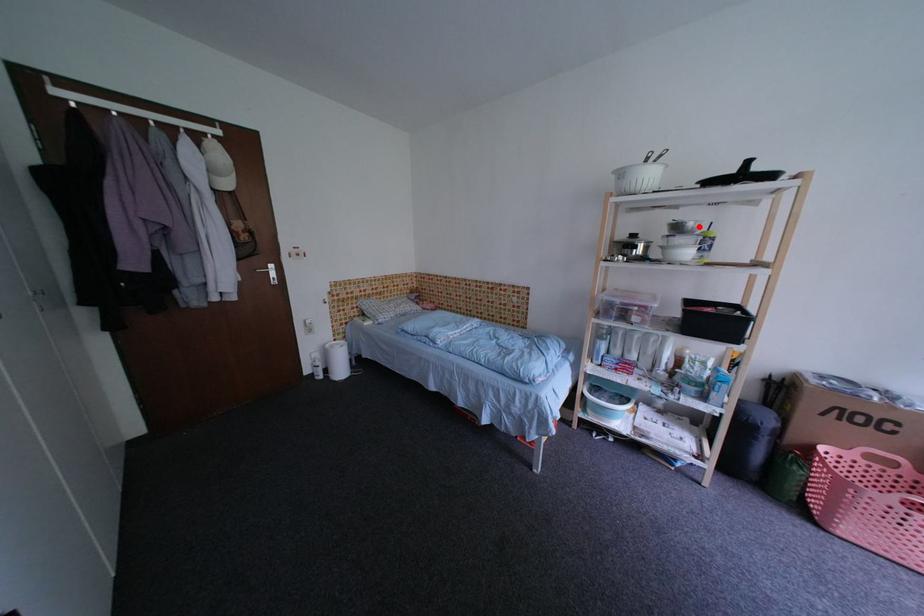
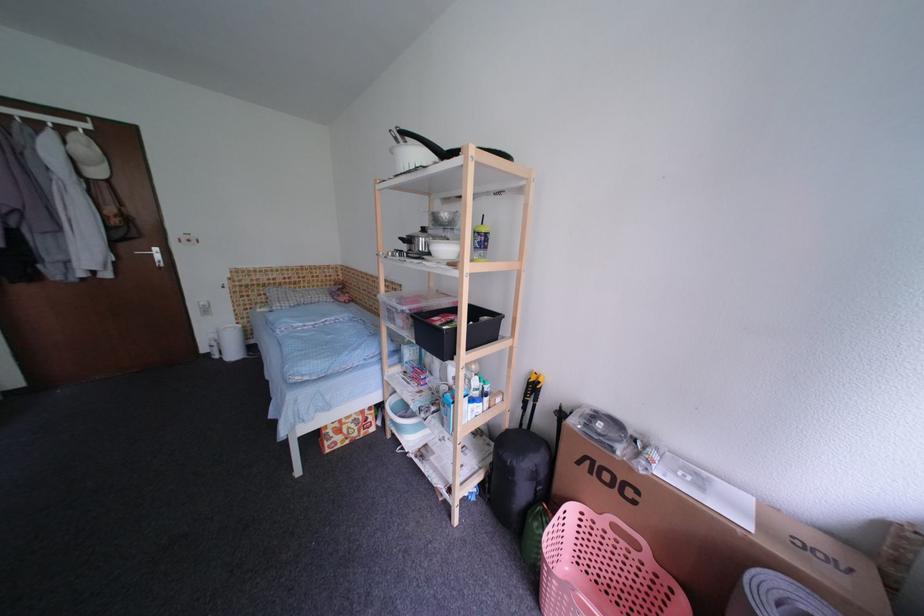
Locate, in the second image, the point that corresponds to the highlighted location in the first image.

(453, 217)